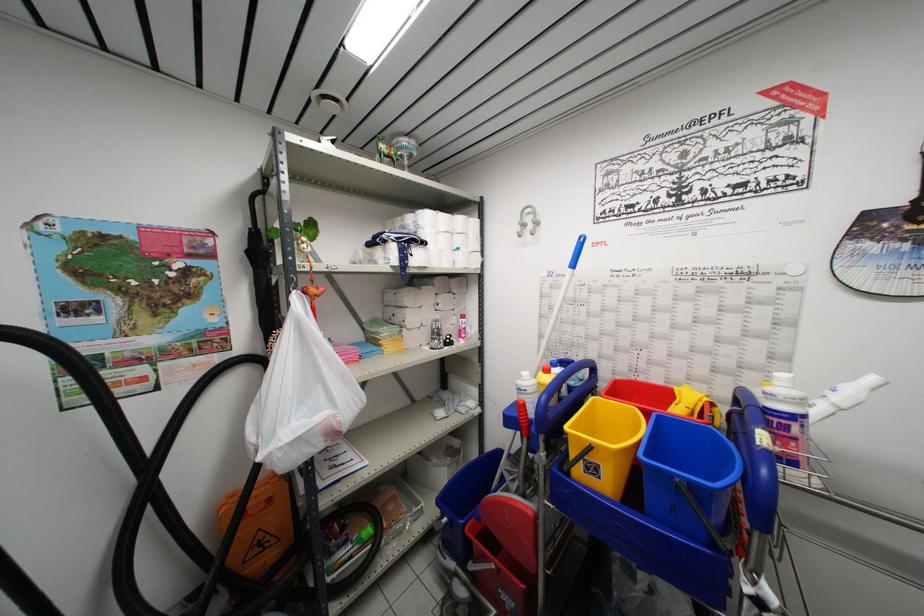
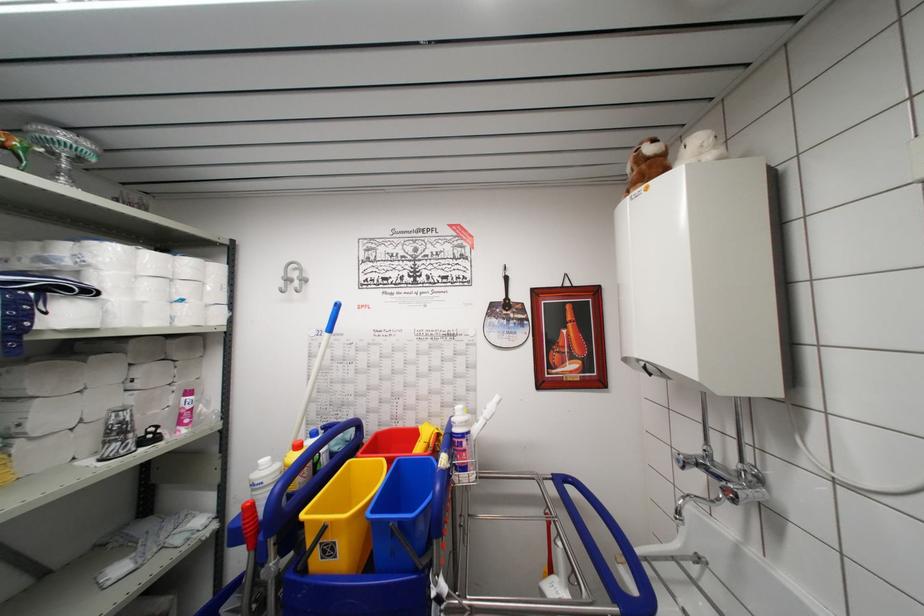
Where in the second image is the point corresponding to (x=457, y=302) from the first image?

(178, 371)